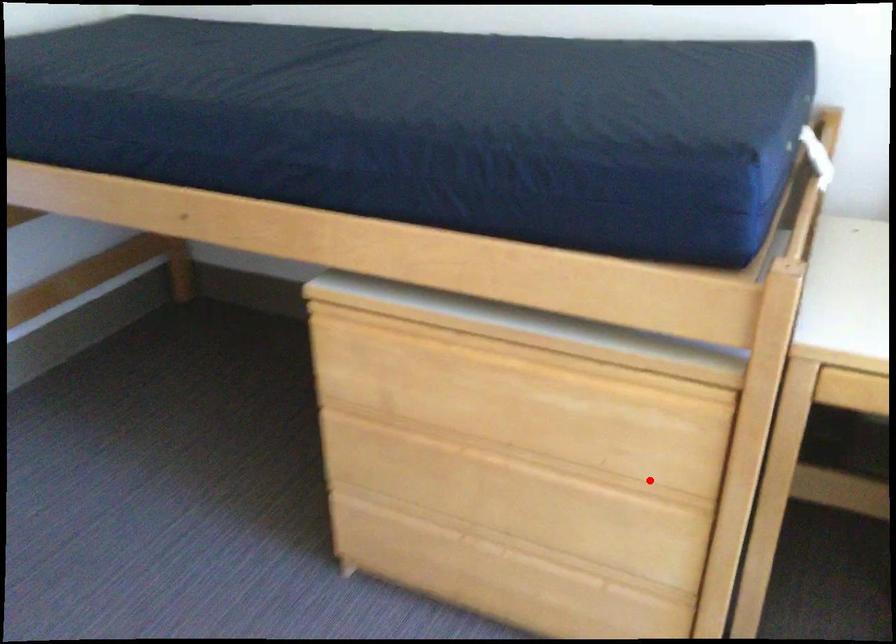
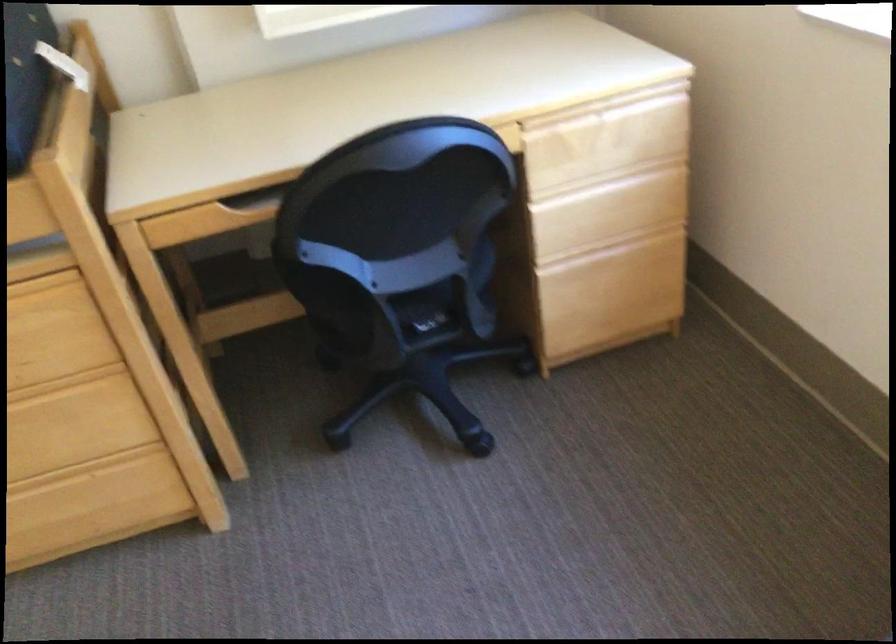
Find the pixel in the second image that matches the highlighted location in the first image.

(64, 383)